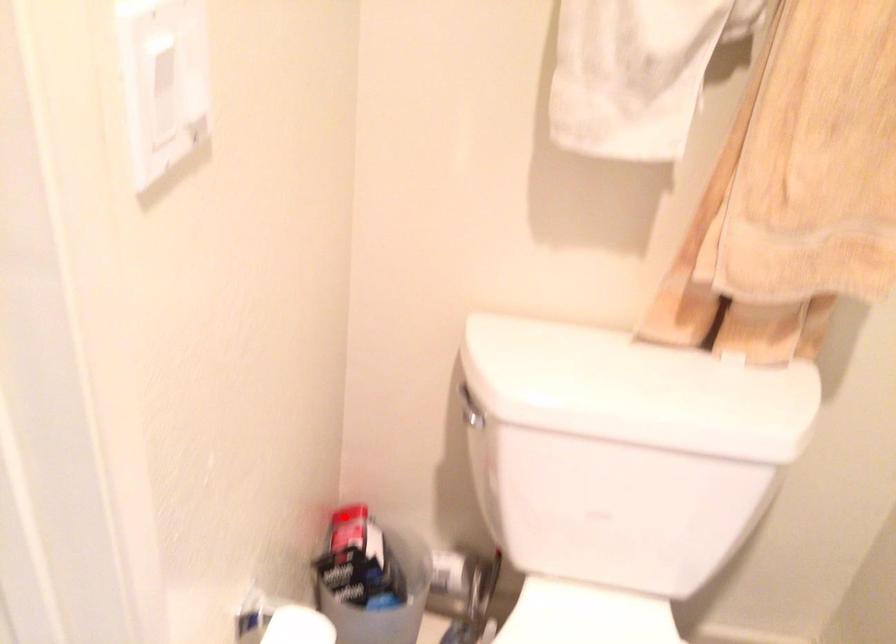
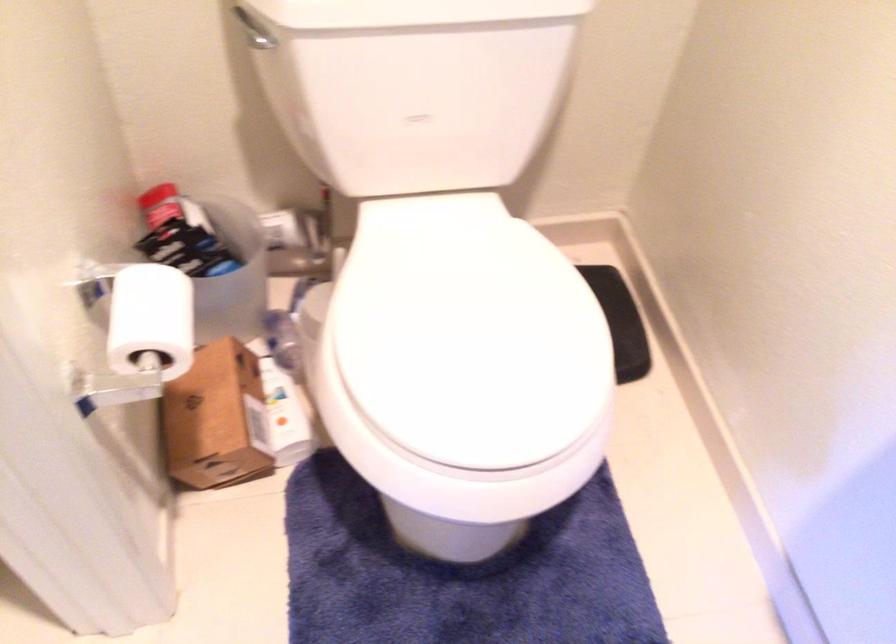
Locate, in the second image, the point that corresponds to the highlighted location in the first image.

(159, 205)